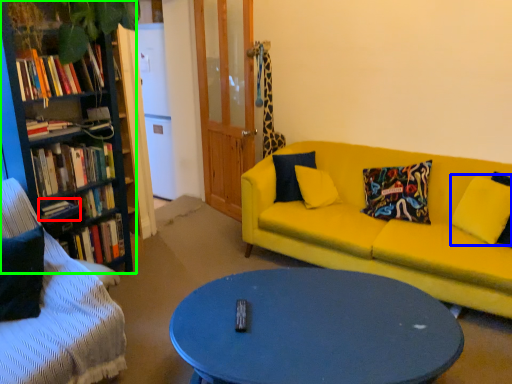
Question: Which is farther away from book (highlighted by a red box)? pillow (highlighted by a blue box) or bookcase (highlighted by a green box)?

Choices:
 (A) pillow
 (B) bookcase

Answer: (A)